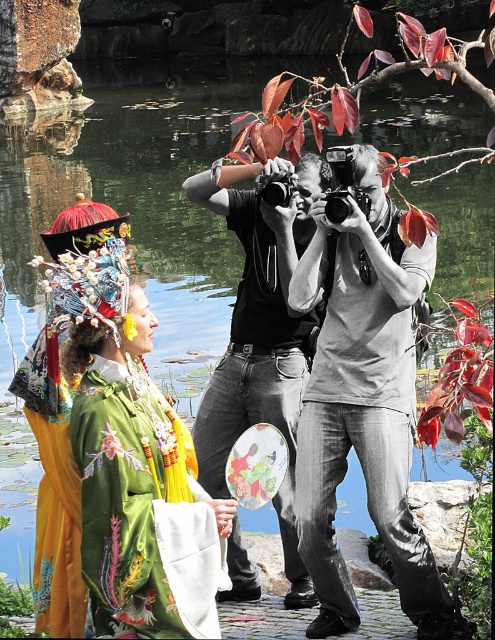
You are a photographer trying to capture both the green satin robe at center and the matte black camera at center in a single frame. Based on their sizes, which object should you focus on first to ensure they are both in focus?

The green satin robe at center is taller than the matte black camera at center, so you should focus on the green satin robe at center first since it is larger and will require more attention to capture details properly.